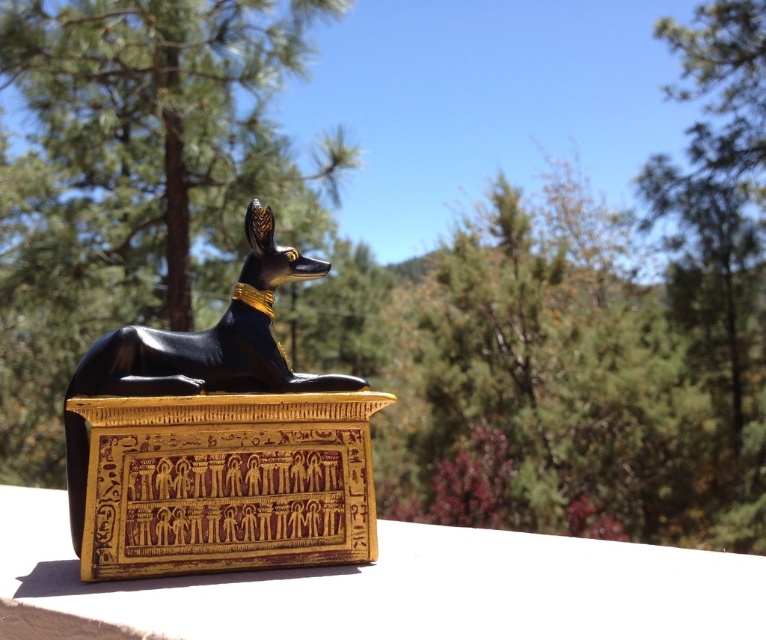
Question: Among these objects, which one is farthest from the camera?

Choices:
 (A) matte gold box at center
 (B) black glossy statue at center

Answer: (B)

Question: Can you confirm if black glossy statue at center is smaller than matte gold box at center?

Choices:
 (A) no
 (B) yes

Answer: (B)

Question: Which of the following is the farthest from the observer?

Choices:
 (A) (198, 420)
 (B) (678, 616)

Answer: (A)

Question: Where is black glossy statue at center located in relation to matte gold box at center in the image?

Choices:
 (A) right
 (B) left

Answer: (A)

Question: Can you confirm if black glossy statue at center is positioned above matte gold box at center?

Choices:
 (A) no
 (B) yes

Answer: (B)